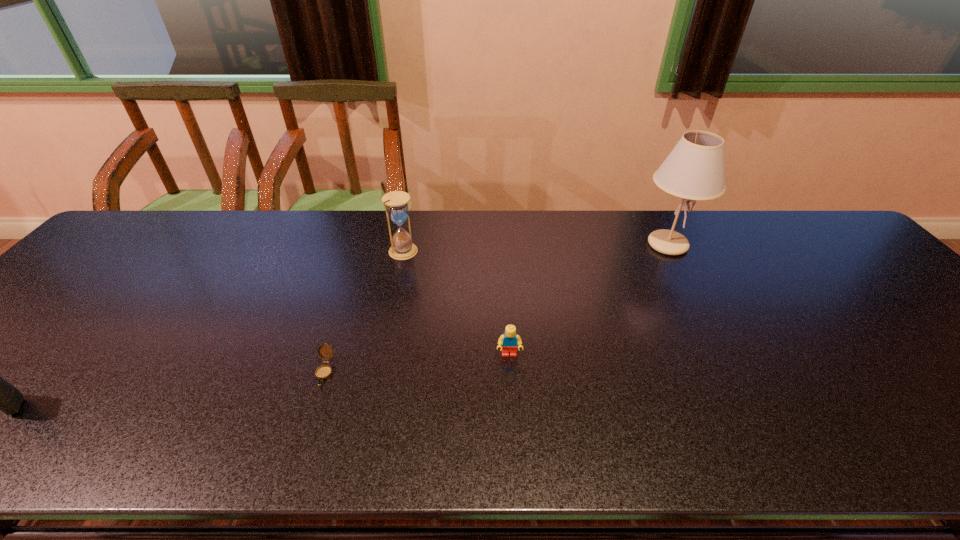
Find the location of a particular element. The width and height of the screenshot is (960, 540). lampshade is located at coordinates (694, 170).

Find the location of `the tallest object`. the tallest object is located at coordinates (694, 170).

Where is `the third object from left to right`? The image size is (960, 540). the third object from left to right is located at coordinates (402, 247).

Where is `the fourth object from left to right`? This screenshot has width=960, height=540. the fourth object from left to right is located at coordinates (509, 340).

Locate an element on the screen. This screenshot has width=960, height=540. the fourth tallest object is located at coordinates (509, 340).

This screenshot has height=540, width=960. I want to click on the second object from left to right, so click(x=323, y=372).

Where is `compass`? compass is located at coordinates (323, 372).

You are a GUI agent. You are given a task and a screenshot of the screen. Output one action in this format:
    pyautogui.click(x=<x>, y=<y>)
    Task: Click on the free spot located on the right of the tallest object
    The height and width of the screenshot is (540, 960).
    Given the screenshot: What is the action you would take?
    pyautogui.click(x=722, y=245)

Find the location of `vacant region located 0.060m on the left of the third object from left to right`. vacant region located 0.060m on the left of the third object from left to right is located at coordinates (368, 251).

Identify the location of free space located on the front-facing side of the second shortest object. (516, 448).